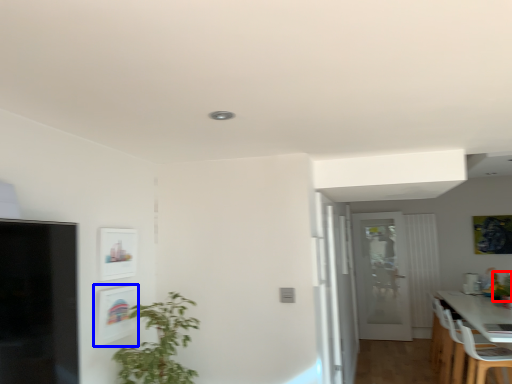
Question: Which object is closer to the camera taking this photo, plant (highlighted by a red box) or picture frame (highlighted by a blue box)?

Choices:
 (A) plant
 (B) picture frame

Answer: (B)